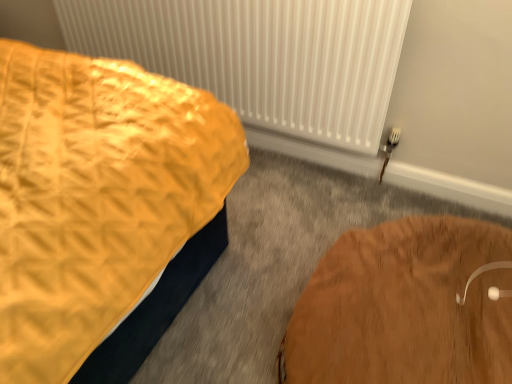
Question: Which is correct: brown wooden table at lower right is inside white textured radiator at upper center, or outside of it?

Choices:
 (A) outside
 (B) inside

Answer: (A)

Question: Is brown wooden table at lower right to the left or to the right of white textured radiator at upper center in the image?

Choices:
 (A) left
 (B) right

Answer: (B)

Question: Is point (502, 291) closer or farther from the camera than point (358, 92)?

Choices:
 (A) farther
 (B) closer

Answer: (B)

Question: Would you say white textured radiator at upper center is inside or outside brown wooden table at lower right?

Choices:
 (A) inside
 (B) outside

Answer: (B)

Question: Considering the positions of white textured radiator at upper center and brown wooden table at lower right in the image, is white textured radiator at upper center bigger or smaller than brown wooden table at lower right?

Choices:
 (A) small
 (B) big

Answer: (A)

Question: From the image's perspective, relative to brown wooden table at lower right, is white textured radiator at upper center above or below?

Choices:
 (A) below
 (B) above

Answer: (B)

Question: In terms of height, does white textured radiator at upper center look taller or shorter compared to brown wooden table at lower right?

Choices:
 (A) short
 (B) tall

Answer: (B)